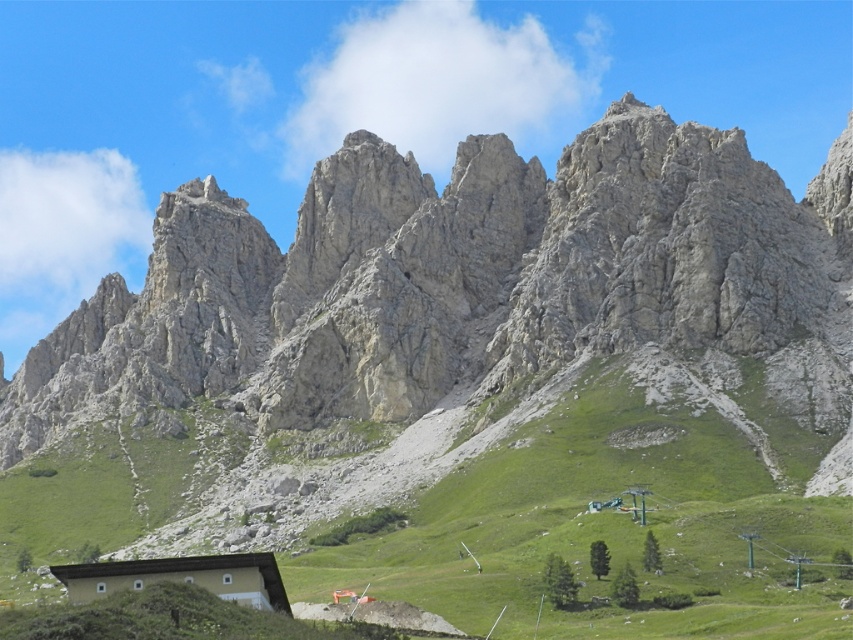
You are standing at the small building with a dark roof and light walls in the foreground of the mountain landscape. You see two points marked in the scene. Which point is closer to you, point (476, 458) or point (71, 586)?

Point (476, 458) is further to the viewer than point (71, 586), so the closer point to you is point (71, 586).

You are planning to hike from the light brown wooden hut at lower center to the green grassy slope at center. Based on the scene description, which direction should you head to reach the slope?

The green grassy slope at center is located above the light brown wooden hut at lower center, so you should head upwards to reach the slope.